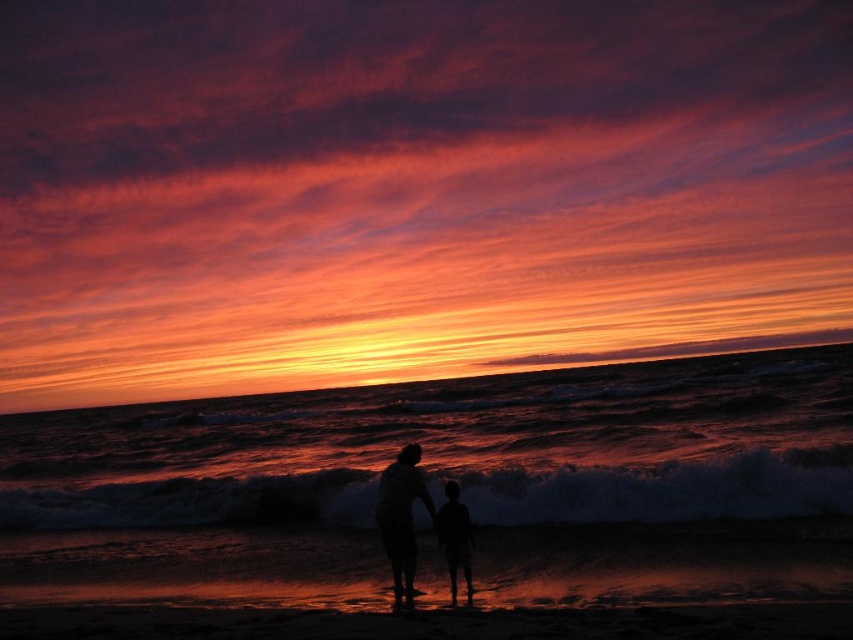
Between dark textured wave at center and silhouette figure at center, which one has more height?

Standing taller between the two is dark textured wave at center.

This screenshot has width=853, height=640. What do you see at coordinates (663, 488) in the screenshot?
I see `dark textured wave at center` at bounding box center [663, 488].

Where is `dark textured wave at center`? This screenshot has height=640, width=853. dark textured wave at center is located at coordinates (663, 488).

Where is `dark textured wave at center`? The width and height of the screenshot is (853, 640). dark textured wave at center is located at coordinates (663, 488).

Between dark textured wave at center and silhouette figure at lower center, which one has less height?

Standing shorter between the two is silhouette figure at lower center.

I want to click on dark textured wave at center, so click(663, 488).

You are a GUI agent. You are given a task and a screenshot of the screen. Output one action in this format:
    pyautogui.click(x=<x>, y=<y>)
    Task: Click on the dark textured wave at center
    This screenshot has width=853, height=640.
    Given the screenshot: What is the action you would take?
    pyautogui.click(x=663, y=488)

Can you confirm if silhouette figure at center is positioned above silhouette figure at lower center?

Indeed, silhouette figure at center is positioned over silhouette figure at lower center.

Does point (418, 476) lie in front of point (444, 484)?

Yes, point (418, 476) is in front of point (444, 484).

Locate an element on the screen. silhouette figure at center is located at coordinates coord(401,516).